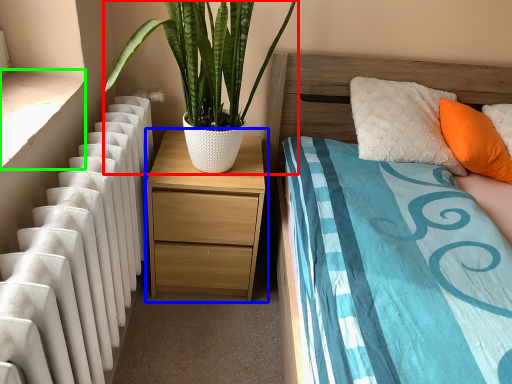
Question: Considering the real-world distances, which object is farthest from houseplant (highlighted by a red box)? nightstand (highlighted by a blue box) or window sill (highlighted by a green box)?

Choices:
 (A) nightstand
 (B) window sill

Answer: (B)